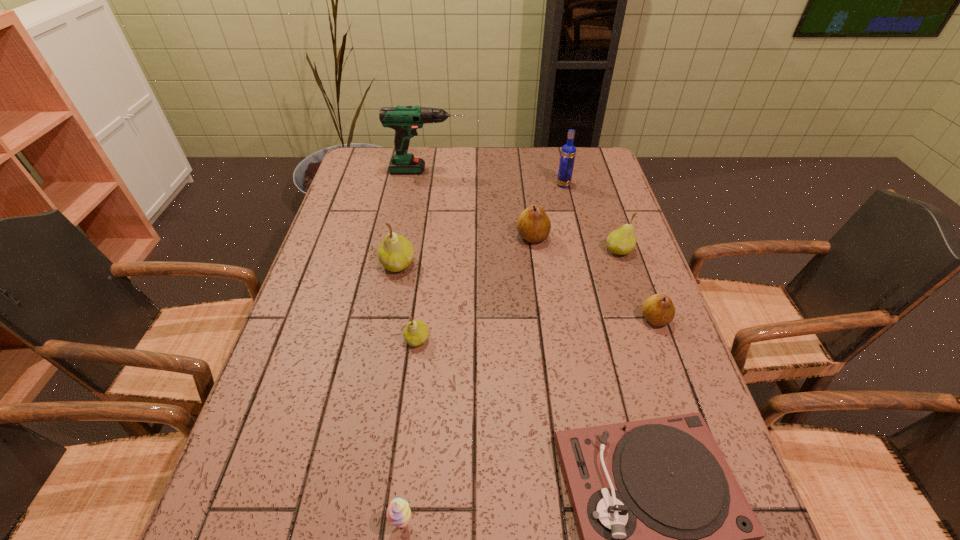
The image size is (960, 540). I want to click on free space that satisfies the following two spatial constraints: 1. on the handle side of the drill; 2. on the front side of the leftmost green pear, so (x=413, y=264).

This screenshot has height=540, width=960. Find the location of `vacant space that satisfies the following two spatial constraints: 1. on the handle side of the farthest object; 2. on the back side of the vodka`. vacant space that satisfies the following two spatial constraints: 1. on the handle side of the farthest object; 2. on the back side of the vodka is located at coordinates (425, 185).

Locate an element on the screen. Image resolution: width=960 pixels, height=540 pixels. vacant space that satisfies the following two spatial constraints: 1. on the handle side of the sherbert; 2. on the left side of the drill is located at coordinates (372, 524).